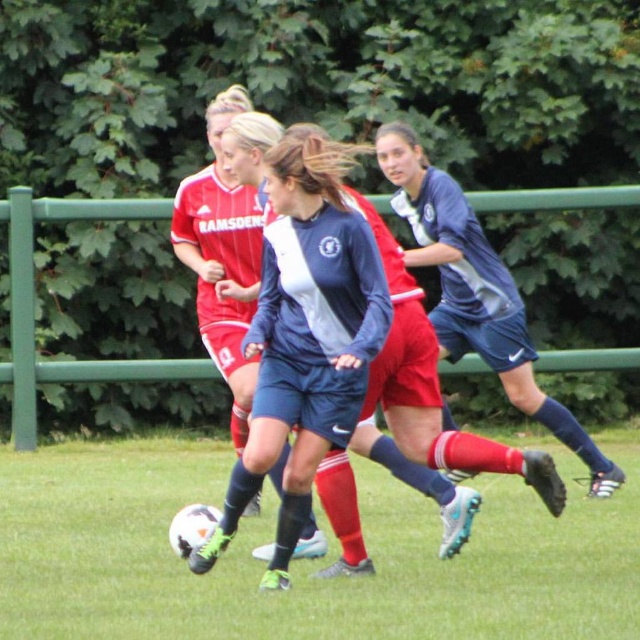
You are a soccer player positioned at the center of the field and you see two points marked on the field. The first point is at coordinates point (378, 336) and the second is at point (193, 248). Which point is nearer to your current position?

Point (378, 336) is closer to the viewer than point (193, 248), so the first point is nearer to your current position.